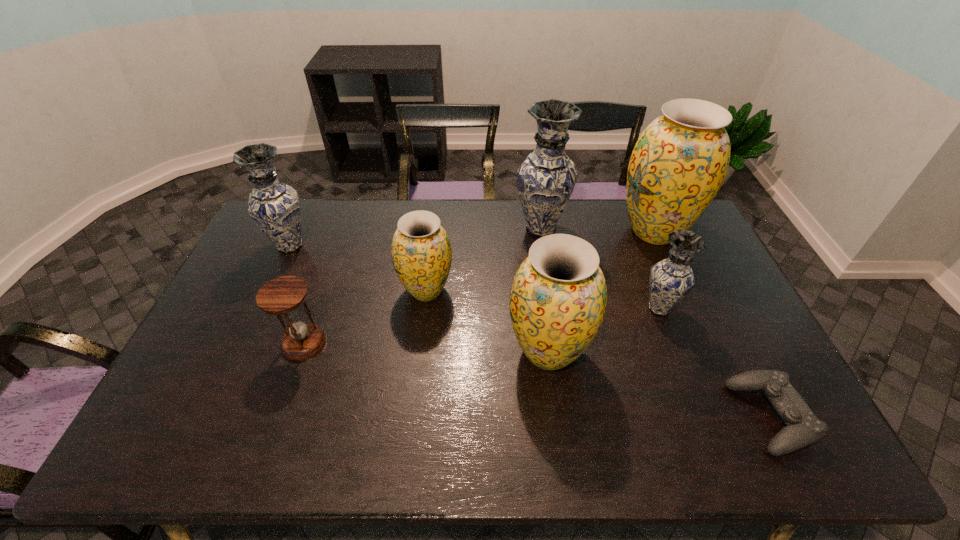
Where is `free space that satisfies the following two spatial constraints: 1. on the front side of the leftmost blue vase; 2. on the left side of the control`? free space that satisfies the following two spatial constraints: 1. on the front side of the leftmost blue vase; 2. on the left side of the control is located at coordinates (211, 417).